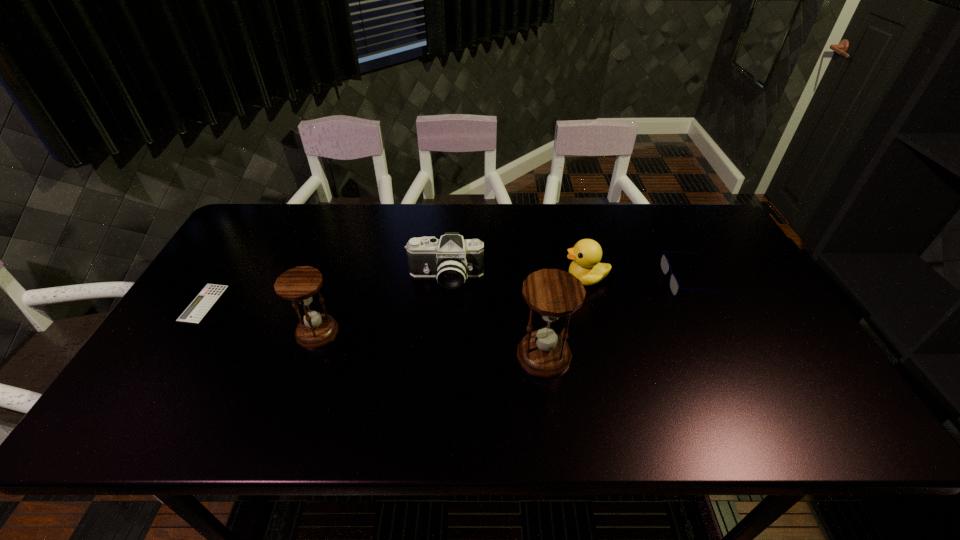
Find the location of a particular element. The width and height of the screenshot is (960, 540). blank area located on the back of the left hourglass is located at coordinates (350, 238).

Find the location of a particular element. vacant space situated 0.190m on the right of the right hourglass is located at coordinates (648, 355).

I want to click on blank space located on the front of the leftmost object, so pos(173,352).

The width and height of the screenshot is (960, 540). Identify the location of vacant position located on the front-facing side of the second shortest object. (645, 282).

Identify the location of free space located 0.330m on the front-facing side of the second shortest object. The image size is (960, 540). (552, 282).

Where is `free spot located on the front-facing side of the second shortest object`? The width and height of the screenshot is (960, 540). free spot located on the front-facing side of the second shortest object is located at coordinates (587, 282).

Find the location of `vacant space located on the front of the camera`. vacant space located on the front of the camera is located at coordinates (442, 330).

Locate an element on the screen. The image size is (960, 540). vacant region located 0.250m on the face of the duck is located at coordinates (477, 279).

Find the location of a particular element. vacant space located on the face of the duck is located at coordinates (528, 279).

Image resolution: width=960 pixels, height=540 pixels. Find the location of `free region located 0.260m on the face of the duck`. free region located 0.260m on the face of the duck is located at coordinates (473, 279).